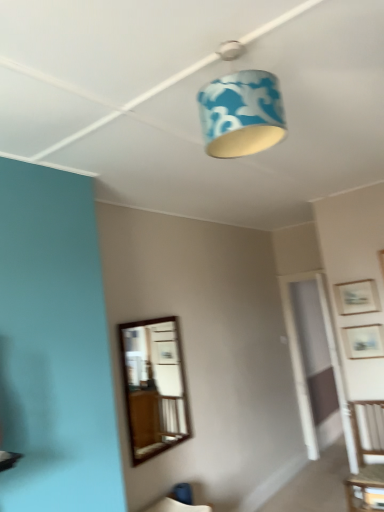
Question: Could you tell me if wooden picture frame at upper right, placed as the second picture frame when sorted from bottom to top, is turned towards wooden table at lower right?

Choices:
 (A) no
 (B) yes

Answer: (A)

Question: From the image's perspective, is wooden picture frame at upper right, placed as the second picture frame when sorted from bottom to top, on top of wooden table at lower right?

Choices:
 (A) yes
 (B) no

Answer: (A)

Question: Does wooden picture frame at upper right, which is the 1th picture frame from top to bottom, have a larger size compared to wooden table at lower right?

Choices:
 (A) yes
 (B) no

Answer: (B)

Question: Is wooden picture frame at upper right, which is the 1th picture frame from top to bottom, positioned with its back to wooden table at lower right?

Choices:
 (A) no
 (B) yes

Answer: (A)

Question: Does wooden picture frame at upper right, which is the 1th picture frame from top to bottom, have a lesser width compared to wooden table at lower right?

Choices:
 (A) no
 (B) yes

Answer: (B)

Question: In terms of height, does wooden table at lower right look taller or shorter compared to blue fabric lampshade at upper center?

Choices:
 (A) short
 (B) tall

Answer: (A)

Question: From the image's perspective, relative to blue fabric lampshade at upper center, is wooden table at lower right above or below?

Choices:
 (A) above
 (B) below

Answer: (B)

Question: In the image, is wooden table at lower right on the left side or the right side of blue fabric lampshade at upper center?

Choices:
 (A) right
 (B) left

Answer: (A)

Question: Does point (380, 492) appear closer or farther from the camera than point (223, 88)?

Choices:
 (A) farther
 (B) closer

Answer: (A)

Question: Looking at their shapes, would you say wooden picture frame at upper right, which is the 1th picture frame from top to bottom, is wider or thinner than wooden picture frame at upper right, placed as the second picture frame when sorted from top to bottom?

Choices:
 (A) thin
 (B) wide

Answer: (A)

Question: Does point (367, 297) appear closer or farther from the camera than point (347, 343)?

Choices:
 (A) farther
 (B) closer

Answer: (B)

Question: From a real-world perspective, is wooden picture frame at upper right, placed as the second picture frame when sorted from bottom to top, positioned above or below wooden picture frame at upper right, which appears as the 1th picture frame when ordered from the bottom?

Choices:
 (A) below
 (B) above

Answer: (B)

Question: Which is correct: wooden picture frame at upper right, placed as the second picture frame when sorted from bottom to top, is inside wooden picture frame at upper right, which appears as the 1th picture frame when ordered from the bottom, or outside of it?

Choices:
 (A) outside
 (B) inside

Answer: (A)

Question: In terms of width, does wooden table at lower right look wider or thinner when compared to wooden picture frame at upper right, which is the 1th picture frame from top to bottom?

Choices:
 (A) wide
 (B) thin

Answer: (A)

Question: Considering the positions of wooden table at lower right and wooden picture frame at upper right, which is the 1th picture frame from top to bottom, in the image, is wooden table at lower right taller or shorter than wooden picture frame at upper right, which is the 1th picture frame from top to bottom,?

Choices:
 (A) short
 (B) tall

Answer: (A)